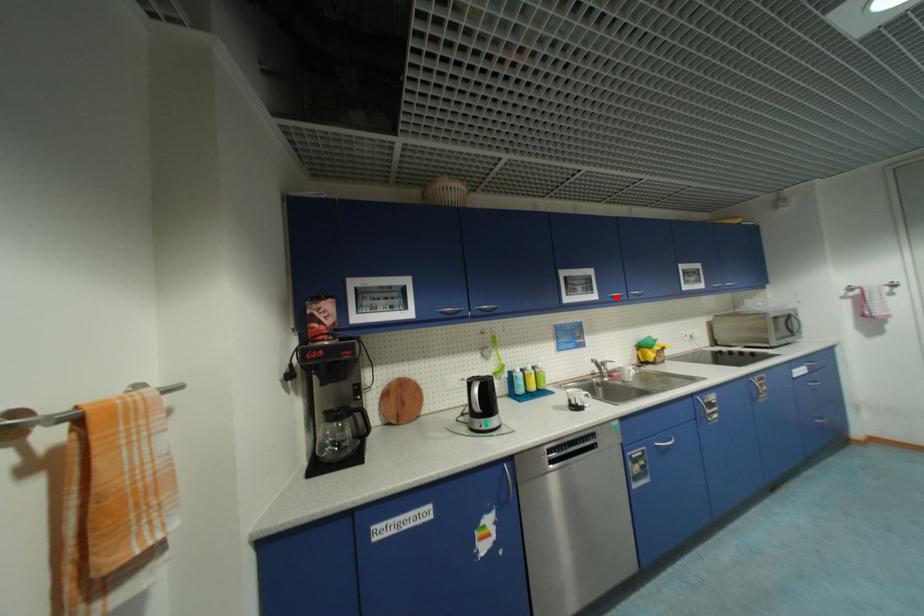
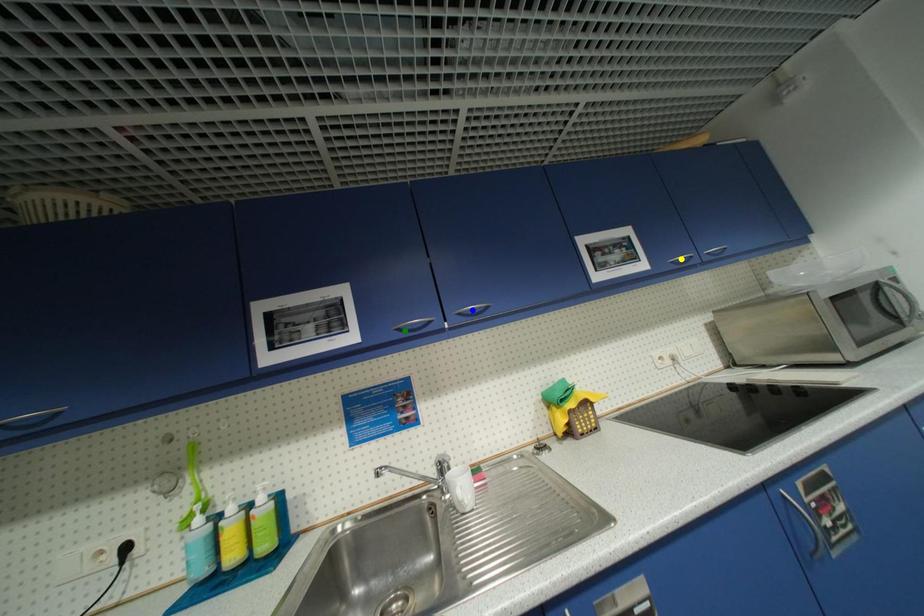
Question: I am providing you with two images of the same scene from different viewpoints. A red point is marked on the first image. You are given multiple points on the second image. Which spot in image 2 lines up with the point in image 1?

Choices:
 (A) blue point
 (B) green point
 (C) yellow point

Answer: (B)